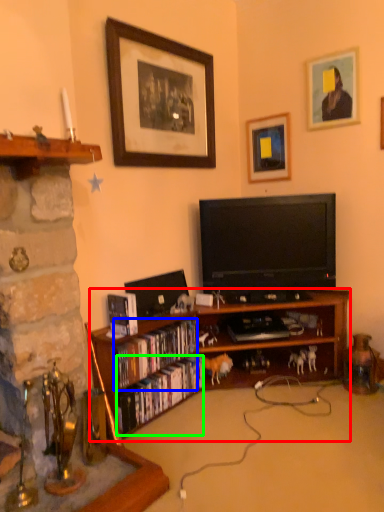
Question: Considering the real-world distances, which object is closest to bookcase (highlighted by a red box)? book (highlighted by a blue box) or book (highlighted by a green box).

Choices:
 (A) book
 (B) book

Answer: (B)